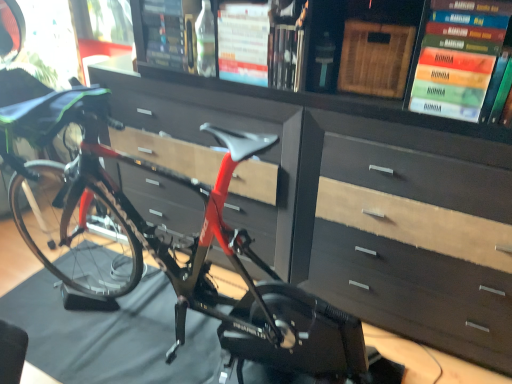
Question: Considering the positions of shiny red bike at center and hardcover book at center, which ranks as the fourth book in right-to-left order, in the image, is shiny red bike at center taller or shorter than hardcover book at center, which ranks as the fourth book in right-to-left order,?

Choices:
 (A) short
 (B) tall

Answer: (B)

Question: Looking at the image, does shiny red bike at center seem bigger or smaller compared to hardcover book at center, the second book from the left?

Choices:
 (A) small
 (B) big

Answer: (B)

Question: Which object is positioned farthest from the clear glass bottle at center?

Choices:
 (A) hardcover book at upper center, the 3th book when ordered from left to right
 (B) hardcover book at upper center, positioned as the 5th book in right-to-left order
 (C) hardcover book at upper right, the 1th book viewed from the right
 (D) shiny red bike at center
 (E) hardcover book at center, which ranks as the fourth book in right-to-left order

Answer: (C)

Question: Considering the real-world distances, which object is farthest from the hardcover book at upper right, the 1th book viewed from the right?

Choices:
 (A) clear glass bottle at center
 (B) shiny red bike at center
 (C) hardcover book at upper right, the second book in the right-to-left sequence
 (D) hardcover book at upper center, the 1th book viewed from the left
 (E) hardcover book at center, which ranks as the fourth book in right-to-left order

Answer: (B)